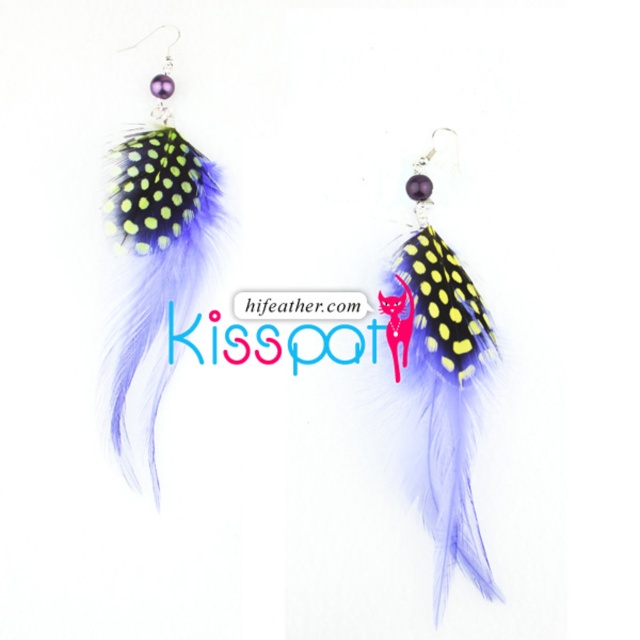
Question: Which point appears farthest from the camera in this image?

Choices:
 (A) (433, 140)
 (B) (141, 323)

Answer: (A)

Question: Is lavender feather earrings at center to the right of matte black feather at left from the viewer's perspective?

Choices:
 (A) no
 (B) yes

Answer: (B)

Question: Which point is farther from the camera taking this photo?

Choices:
 (A) (132, 220)
 (B) (429, 275)

Answer: (B)

Question: Which point is farther to the camera?

Choices:
 (A) (193, 273)
 (B) (470, 426)

Answer: (A)

Question: Does lavender feather earrings at center appear over matte black feather at left?

Choices:
 (A) no
 (B) yes

Answer: (A)

Question: Observing the image, what is the correct spatial positioning of lavender feather earrings at center in reference to matte black feather at left?

Choices:
 (A) right
 (B) left

Answer: (A)